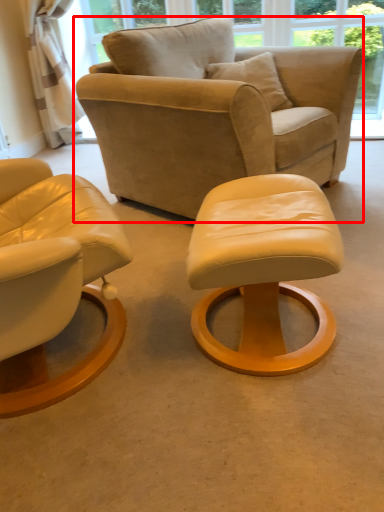
Question: Where is chair (annotated by the red box) located in relation to stool in the image?

Choices:
 (A) left
 (B) right

Answer: (A)